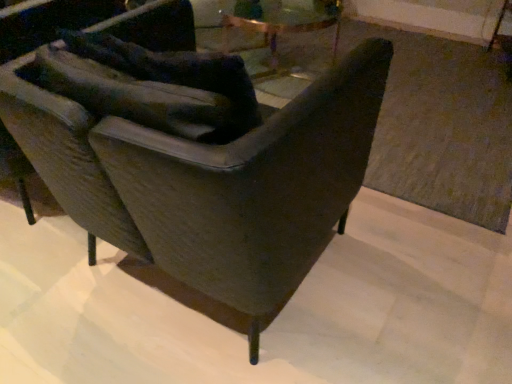
Question: In the image, is dark gray leather rocking chair at center on the left side or the right side of matte gray chair at left?

Choices:
 (A) right
 (B) left

Answer: (A)

Question: From a real-world perspective, is dark gray leather rocking chair at center positioned above or below matte gray chair at left?

Choices:
 (A) below
 (B) above

Answer: (B)

Question: In terms of height, does dark gray leather rocking chair at center look taller or shorter compared to matte gray chair at left?

Choices:
 (A) short
 (B) tall

Answer: (A)

Question: Considering their positions, is matte gray chair at left located in front of or behind dark gray leather rocking chair at center?

Choices:
 (A) behind
 (B) front

Answer: (A)

Question: Looking at their shapes, would you say matte gray chair at left is wider or thinner than dark gray leather rocking chair at center?

Choices:
 (A) thin
 (B) wide

Answer: (A)

Question: From a real-world perspective, is matte gray chair at left physically located above or below dark gray leather rocking chair at center?

Choices:
 (A) above
 (B) below

Answer: (B)

Question: Would you say matte gray chair at left is to the left or to the right of dark gray leather rocking chair at center in the picture?

Choices:
 (A) right
 (B) left

Answer: (B)